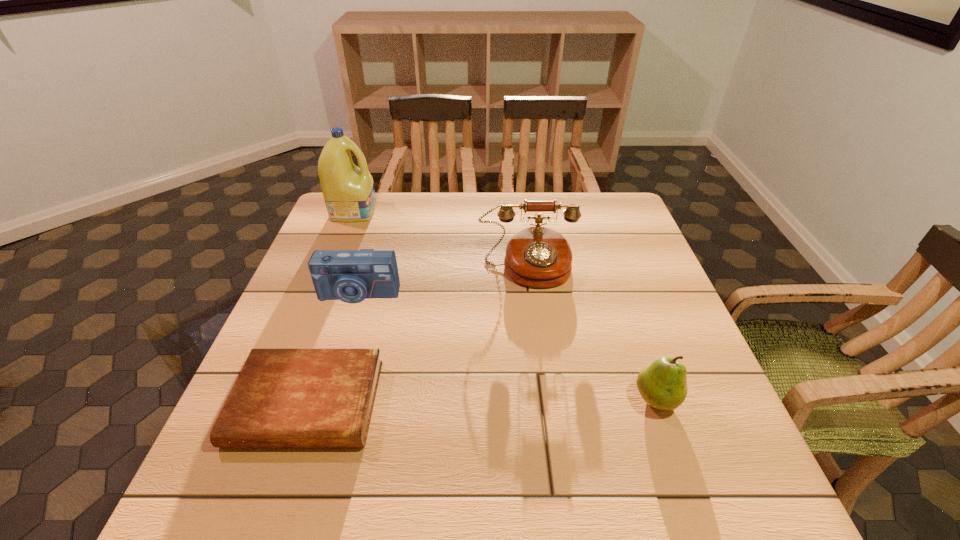
In order to click on vacant area between the tallest object and the Bible in this screenshot , I will do `click(330, 307)`.

Locate an element on the screen. Image resolution: width=960 pixels, height=540 pixels. free area in between the pear and the detergent is located at coordinates (505, 305).

This screenshot has width=960, height=540. I want to click on the third closest object relative to the rightmost object, so click(x=351, y=276).

Identify which object is located as the fourth nearest to the camera. Please provide its 2D coordinates. Your answer should be formatted as a tuple, i.e. [(x, y)], where the tuple contains the x and y coordinates of a point satisfying the conditions above.

[(662, 384)]

This screenshot has width=960, height=540. Identify the location of vacant region that satisfies the following two spatial constraints: 1. on the label of the farthest object; 2. on the left side of the pear. (279, 399).

This screenshot has height=540, width=960. Find the location of `vacant space that satisfies the following two spatial constraints: 1. on the dial of the second tallest object; 2. on the left side of the rightmost object`. vacant space that satisfies the following two spatial constraints: 1. on the dial of the second tallest object; 2. on the left side of the rightmost object is located at coordinates (545, 399).

Find the location of `free region that satisfies the following two spatial constraints: 1. on the lens of the camera; 2. on the right side of the rightmost object`. free region that satisfies the following two spatial constraints: 1. on the lens of the camera; 2. on the right side of the rightmost object is located at coordinates (326, 399).

The width and height of the screenshot is (960, 540). Find the location of `vacant region that satisfies the following two spatial constraints: 1. on the dial of the telephone; 2. on the left side of the pear`. vacant region that satisfies the following two spatial constraints: 1. on the dial of the telephone; 2. on the left side of the pear is located at coordinates (545, 399).